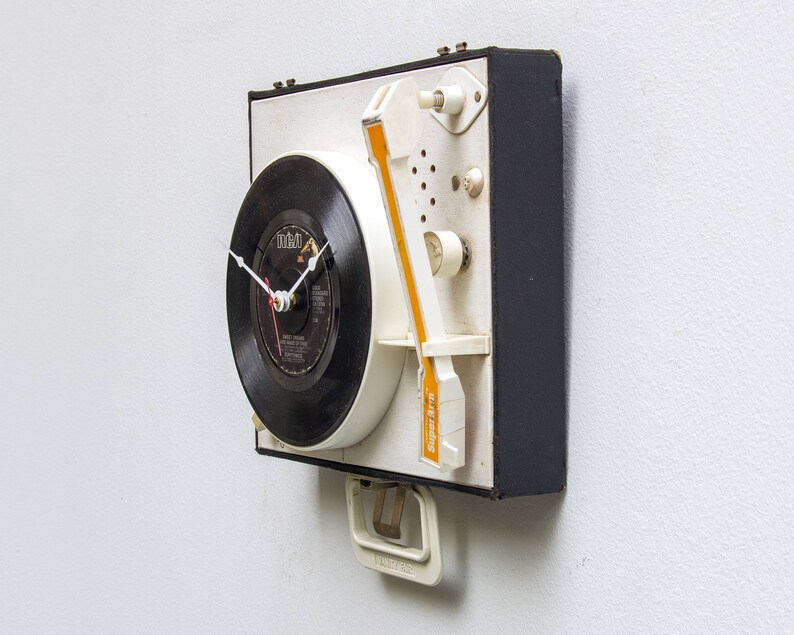
Locate an element on the screen. The width and height of the screenshot is (794, 635). handle is located at coordinates (405, 566).